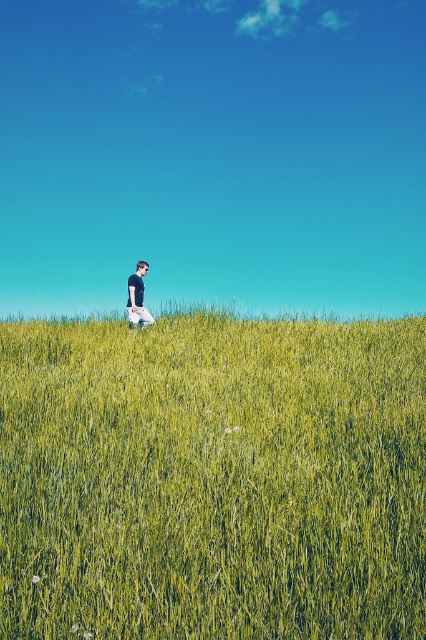
Is green grassy field at center in front of matte black t-shirt at center?

That is True.

Between point (6, 433) and point (135, 310), which one is positioned in front?

Point (6, 433) is more forward.

Is point (400, 364) in front of point (138, 275)?

That is True.

The width and height of the screenshot is (426, 640). Find the location of `green grassy field at center`. green grassy field at center is located at coordinates (213, 480).